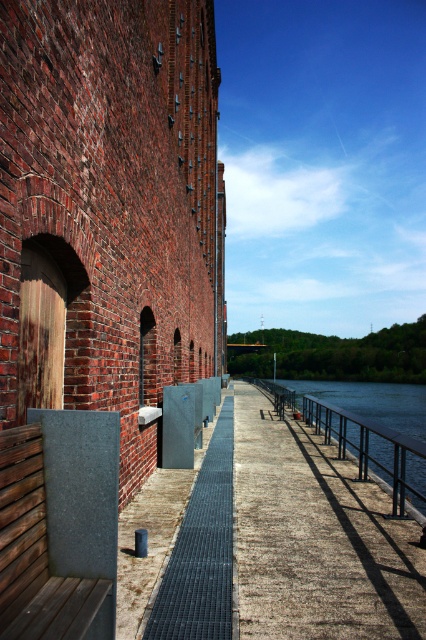
You are a maintenance worker standing at the wooden door at the base of the brick building. You need to reach both the point at coordinates point (80, 593) and point (172, 632) along the walkway. Which point should you reach first if you want to follow the shortest path to both points?

You should reach point (80, 593) first because it is in front of point (172, 632), meaning it is closer to your starting position at the wooden door.

You are standing on the walkway near the brick building and want to reach the water. There are two points marked on the walkway at coordinates point (264, 442) and point (97, 502). Which point is closer to the water?

Point (97, 502) is closer to the water because point (264, 442) is behind it, meaning it is farther away from the water edge.

You are a maintenance worker needing to place a 3 meter wide equipment on the walkway. The walkway is narrow. Which object, the dark gray textured bench at lower left or the dark gray metal grate at center, should you avoid placing the equipment near to ensure enough space?

You should avoid placing the equipment near the dark gray textured bench at lower left because it has a lesser width compared to the dark gray metal grate at center, meaning there is more space near the grate.